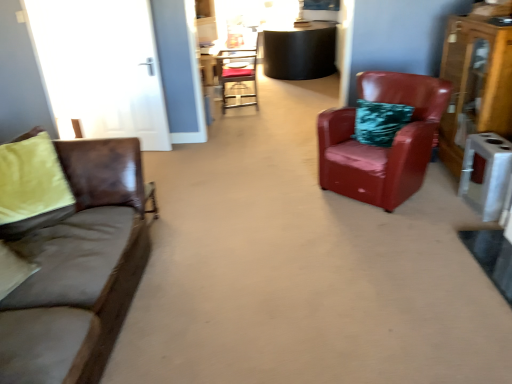
Question: From a real-world perspective, is brown leather couch at left physically located above or below leather armchair at right, which ranks as the second chair in left-to-right order?

Choices:
 (A) above
 (B) below

Answer: (A)

Question: Is point (42, 273) positioned closer to the camera than point (376, 100)?

Choices:
 (A) closer
 (B) farther

Answer: (A)

Question: Estimate the real-world distances between objects in this image. Which object is farther from the metallic silver chair at center, marked as the 1th chair in a top-to-bottom arrangement?

Choices:
 (A) brown leather couch at left
 (B) wooden dresser at right
 (C) leather armchair at right, which ranks as the second chair in back-to-front order

Answer: (A)

Question: Based on their relative distances, which object is farther from the brown leather couch at left?

Choices:
 (A) metallic silver chair at center, marked as the 1th chair in a top-to-bottom arrangement
 (B) wooden dresser at right
 (C) leather armchair at right, which is counted as the first chair, starting from the front

Answer: (A)